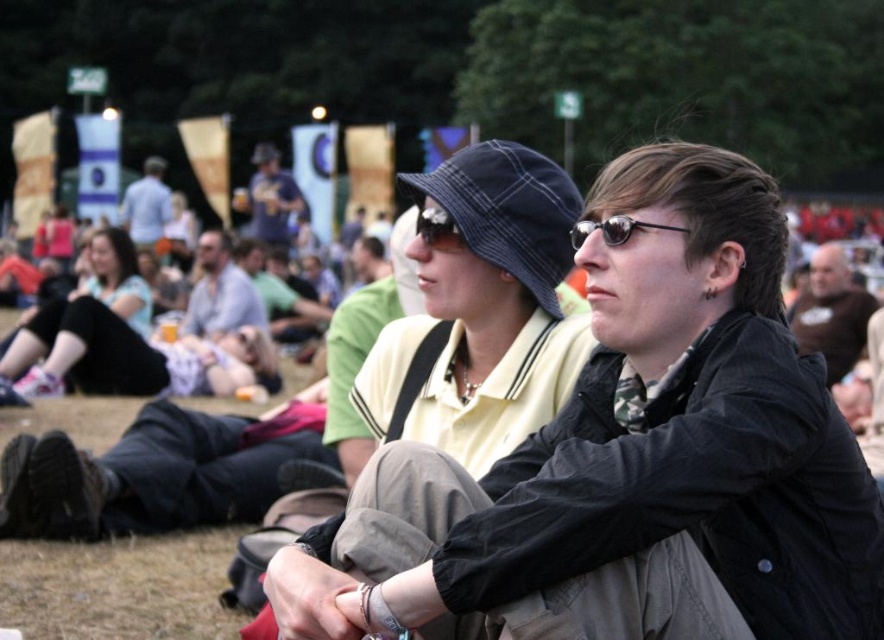
Question: Based on their relative distances, which object is nearer to the dark brown leather jacket at upper right?

Choices:
 (A) dark blue plaid hat at center
 (B) matte black jacket at center
 (C) sunglasses at center

Answer: (C)

Question: Which of the following is the farthest from the observer?

Choices:
 (A) (417, 225)
 (B) (141, 182)
 (C) (278, 182)

Answer: (B)

Question: Is matte black jacket at center to the right of matte black goggles at center from the viewer's perspective?

Choices:
 (A) no
 (B) yes

Answer: (A)

Question: From the image, what is the correct spatial relationship of matte black jacket at center in relation to matte black goggles at center?

Choices:
 (A) below
 (B) above

Answer: (A)

Question: Is light gray shirt at center positioned before blue denim shirt at center?

Choices:
 (A) no
 (B) yes

Answer: (B)

Question: Which point is farther to the camera?

Choices:
 (A) matte black jacket at center
 (B) matte black goggles at center
 (C) light blue shirt at upper center

Answer: (C)